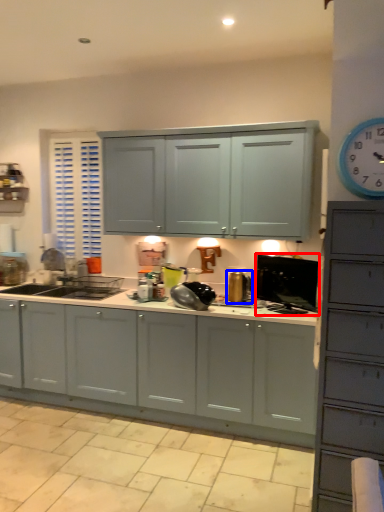
Question: Among these objects, which one is nearest to the camera, appliance (highlighted by a red box) or appliance (highlighted by a blue box)?

Choices:
 (A) appliance
 (B) appliance

Answer: (A)